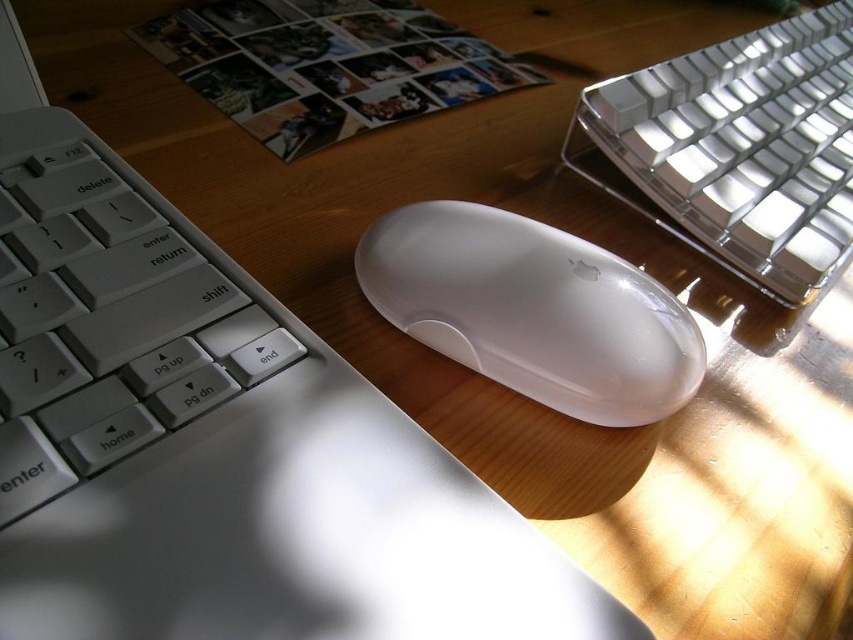
Which is above, satin silver keyboard at upper right or satin white mouse at center?

satin silver keyboard at upper right is higher up.

You are a GUI agent. You are given a task and a screenshot of the screen. Output one action in this format:
    pyautogui.click(x=<x>, y=<y>)
    Task: Click on the satin silver keyboard at upper right
    The image size is (853, 640).
    Given the screenshot: What is the action you would take?
    pyautogui.click(x=741, y=145)

What are the coordinates of `satin silver keyboard at upper right` in the screenshot? It's located at (741, 145).